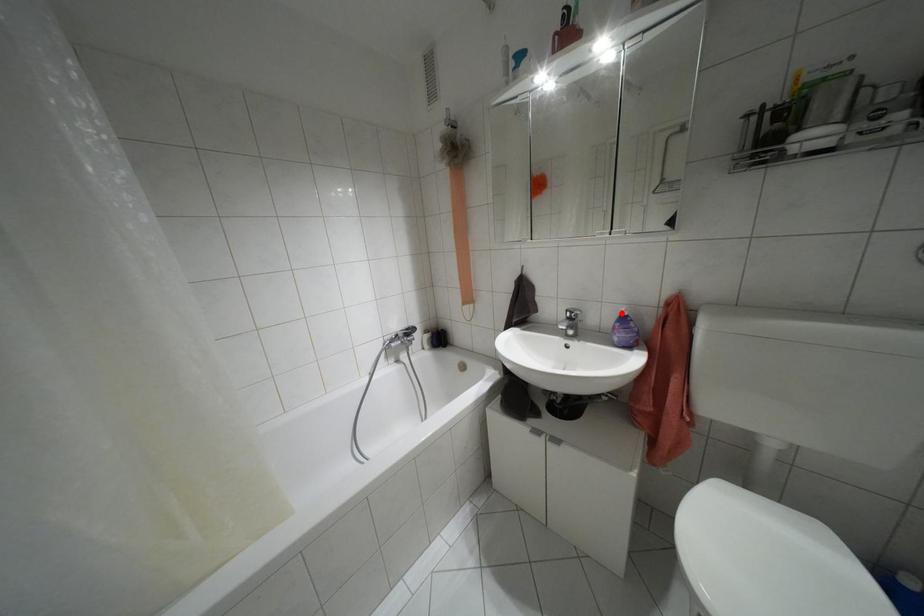
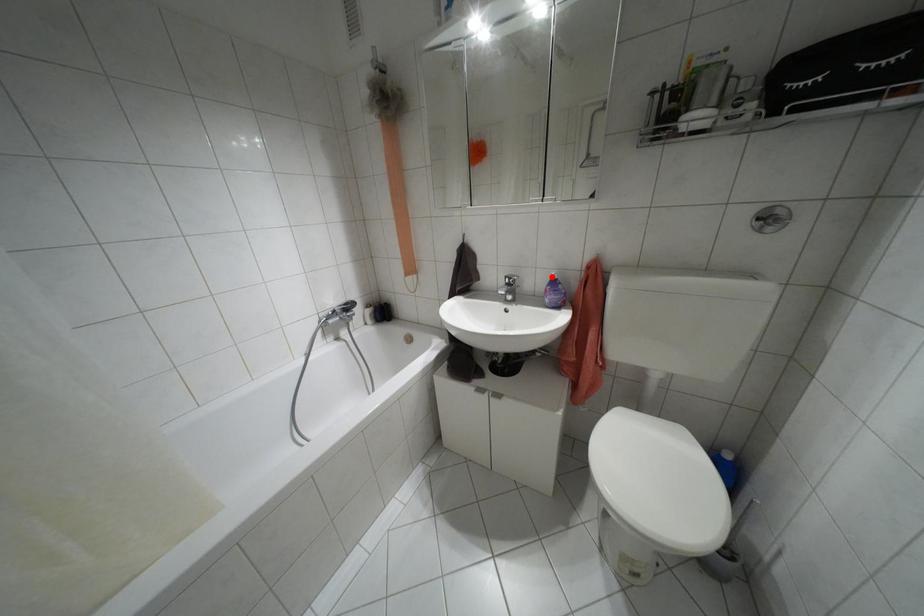
I am providing you with two images of the same scene from different viewpoints. A red point is marked on the first image and another point is marked on the second image. Is the marked point in image1 the same physical position as the marked point in image2?

Yes